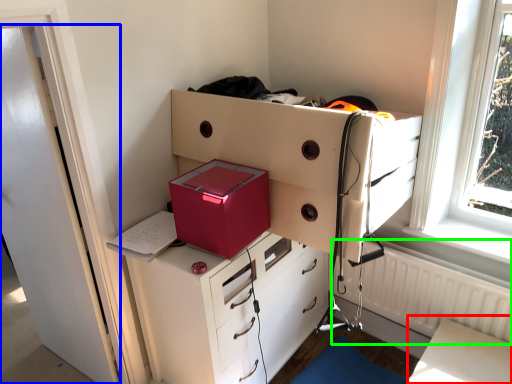
Question: Estimate the real-world distances between objects in this image. Which object is closer to table (highlighted by a red box), door (highlighted by a blue box) or radiator (highlighted by a green box)?

Choices:
 (A) door
 (B) radiator

Answer: (B)